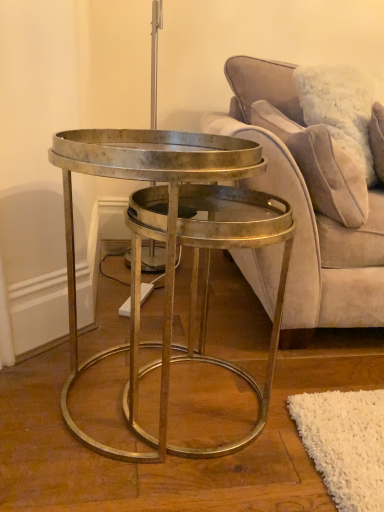
Where is `metallic gold coffee table at center`? metallic gold coffee table at center is located at coordinates (174, 246).

Locate an element on the screen. This screenshot has width=384, height=512. velvet beige couch at center is located at coordinates (310, 205).

Locate an element on the screen. The width and height of the screenshot is (384, 512). metallic gold coffee table at center is located at coordinates (174, 246).

Considering the relative sizes of velvet beige couch at center and metallic gold coffee table at center in the image provided, is velvet beige couch at center smaller than metallic gold coffee table at center?

Actually, velvet beige couch at center might be larger than metallic gold coffee table at center.

In the image, is velvet beige couch at center positioned in front of or behind metallic gold coffee table at center?

In the image, velvet beige couch at center appears behind metallic gold coffee table at center.

Would you say velvet beige couch at center is to the left or to the right of metallic gold coffee table at center in the picture?

velvet beige couch at center is positioned on metallic gold coffee table at center's right side.

From a real-world perspective, does metallic gold coffee table at center stand above velvet beige pillow at upper right?

No.

Does metallic gold coffee table at center appear on the left side of velvet beige pillow at upper right?

Correct, you'll find metallic gold coffee table at center to the left of velvet beige pillow at upper right.

Measure the distance between metallic gold coffee table at center and velvet beige pillow at upper right.

metallic gold coffee table at center and velvet beige pillow at upper right are 16.81 inches apart from each other.

Considering the positions of point (240, 446) and point (334, 170), is point (240, 446) closer or farther from the camera than point (334, 170)?

Point (240, 446) appears to be closer to the viewer than point (334, 170).

Is velvet beige pillow at upper right far away from velvet beige couch at center?

velvet beige pillow at upper right is near velvet beige couch at center, not far away.

Which of these two, velvet beige pillow at upper right or velvet beige couch at center, stands taller?

velvet beige couch at center.

Based on the photo, how different are the orientations of velvet beige pillow at upper right and velvet beige couch at center in degrees?

There is a 88.1-degree angle between the facing directions of velvet beige pillow at upper right and velvet beige couch at center.

Does point (270, 119) appear closer or farther from the camera than point (305, 221)?

Clearly, point (270, 119) is more distant from the camera than point (305, 221).

Which is in front, point (358, 210) or point (78, 372)?

The point (78, 372) is more forward.

Considering their positions, is velvet beige pillow at upper right located in front of or behind metallic gold coffee table at center?

In the image, velvet beige pillow at upper right appears behind metallic gold coffee table at center.

Locate an element on the screen. coffee table in front of the velvet beige pillow at upper right is located at coordinates (174, 246).

Is metallic gold coffee table at center next to velvet beige couch at center and touching it?

No, metallic gold coffee table at center is not next to velvet beige couch at center.

From the picture: Considering the sizes of objects metallic gold coffee table at center and velvet beige couch at center in the image provided, who is wider, metallic gold coffee table at center or velvet beige couch at center?

With larger width is velvet beige couch at center.

Considering the relative sizes of metallic gold coffee table at center and velvet beige couch at center in the image provided, is metallic gold coffee table at center taller than velvet beige couch at center?

In fact, metallic gold coffee table at center may be shorter than velvet beige couch at center.

Can you confirm if metallic gold coffee table at center is bigger than velvet beige couch at center?

No.

Between velvet beige couch at center and velvet beige pillow at upper right, which one has smaller size?

Smaller between the two is velvet beige pillow at upper right.

Between velvet beige couch at center and velvet beige pillow at upper right, which one appears on the right side from the viewer's perspective?

velvet beige couch at center is more to the right.

Which of these two, velvet beige couch at center or velvet beige pillow at upper right, stands shorter?

With less height is velvet beige pillow at upper right.

Is velvet beige couch at center outside of velvet beige pillow at upper right?

Yes, velvet beige couch at center is not within velvet beige pillow at upper right.

The height and width of the screenshot is (512, 384). In order to click on coffee table in front of the velvet beige couch at center in this screenshot , I will do `click(174, 246)`.

Find the location of a particular element. The image size is (384, 512). pillow above the metallic gold coffee table at center (from the image's perspective) is located at coordinates (320, 166).

From the image, which object appears to be nearer to metallic gold coffee table at center, velvet beige pillow at upper right or velvet beige couch at center?

velvet beige couch at center is closer to metallic gold coffee table at center.

Looking at the image, which one is located closer to velvet beige pillow at upper right, velvet beige couch at center or metallic gold coffee table at center?

Based on the image, velvet beige couch at center appears to be nearer to velvet beige pillow at upper right.

Estimate the real-world distances between objects in this image. Which object is further from velvet beige couch at center, metallic gold coffee table at center or velvet beige pillow at upper right?

The object further to velvet beige couch at center is metallic gold coffee table at center.

Which object lies nearer to the anchor point velvet beige couch at center, velvet beige pillow at upper right or metallic gold coffee table at center?

velvet beige pillow at upper right lies closer to velvet beige couch at center than the other object.

When comparing their distances from velvet beige pillow at upper right, does metallic gold coffee table at center or velvet beige couch at center seem closer?

velvet beige couch at center is closer to velvet beige pillow at upper right.

From the image, which object appears to be farther from metallic gold coffee table at center, velvet beige couch at center or velvet beige pillow at upper right?

velvet beige pillow at upper right lies further to metallic gold coffee table at center than the other object.

The height and width of the screenshot is (512, 384). Identify the location of pillow between metallic gold coffee table at center and velvet beige couch at center. 320,166.